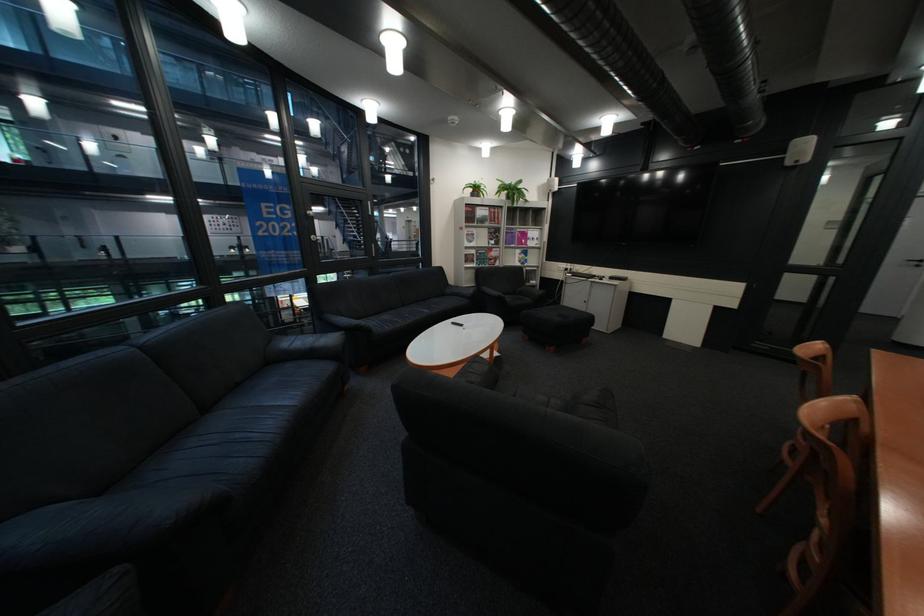
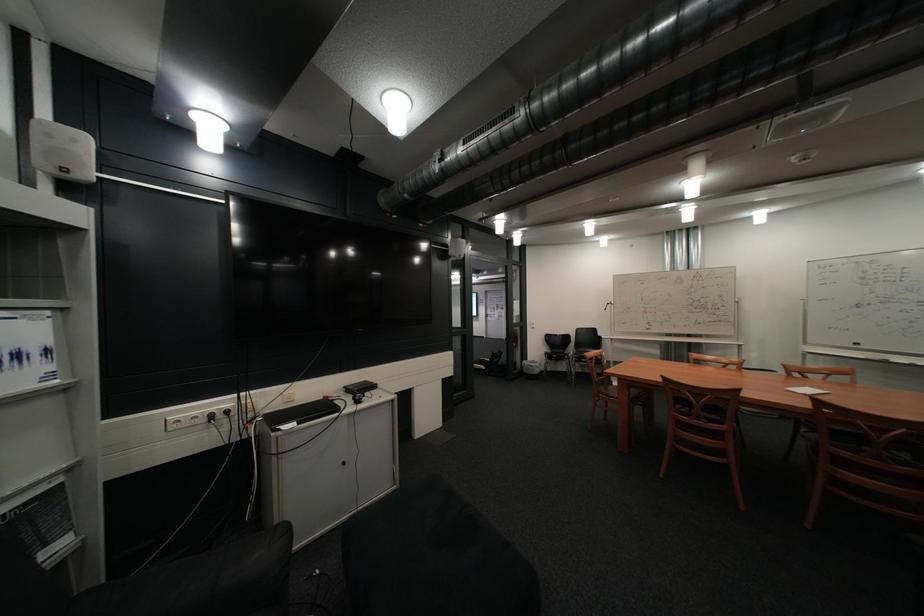
The point at (550, 246) is marked in the first image. Where is the corresponding point in the second image?

(46, 386)